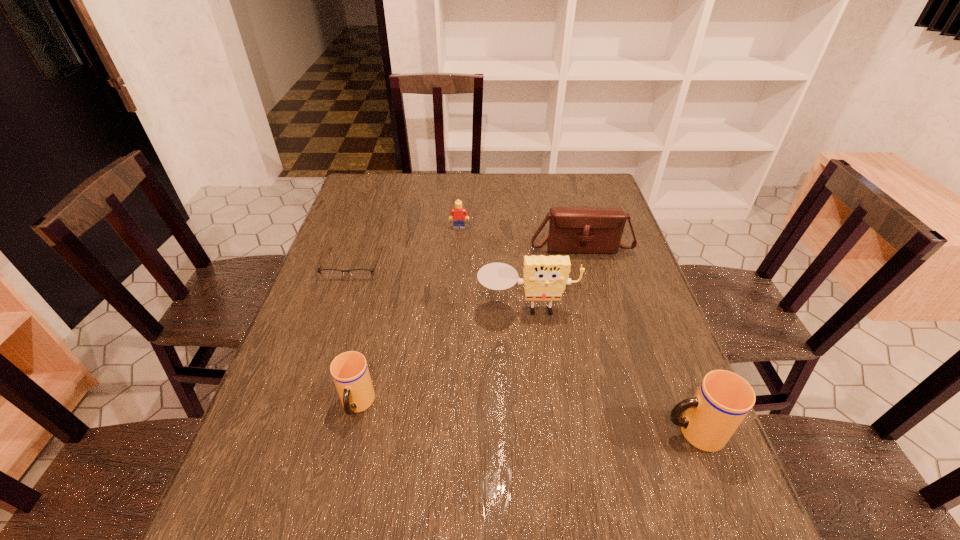
The image size is (960, 540). In the image, there is a desktop. In order to click on vacant area at the near edge in this screenshot , I will do click(x=628, y=472).

The image size is (960, 540). Find the location of `free space at the left edge of the desktop`. free space at the left edge of the desktop is located at coordinates (367, 287).

In the image, there is a desktop. At what (x,y) coordinates should I click in order to perform the action: click on free region at the right edge. Please return your answer as a coordinate pair (x, y). Looking at the image, I should click on (611, 288).

I want to click on free space at the far left corner, so click(385, 173).

Identify the location of vacant space at the far right corner of the desktop. (571, 200).

At what (x,y) coordinates should I click in order to perform the action: click on free space at the near right corner. Please return your answer as a coordinate pair (x, y). The image size is (960, 540). Looking at the image, I should click on click(x=644, y=444).

Identify the location of vacant area that lies between the sponge and the shortest object. The image size is (960, 540). (440, 286).

The height and width of the screenshot is (540, 960). Identify the location of free space between the shoulder bag and the farthest object. (519, 237).

Identify the location of free space between the shorter cup and the spectacles. Image resolution: width=960 pixels, height=540 pixels. (355, 334).

Where is `vacant area that lies between the shoulder bag and the taller cup`? vacant area that lies between the shoulder bag and the taller cup is located at coordinates (636, 339).